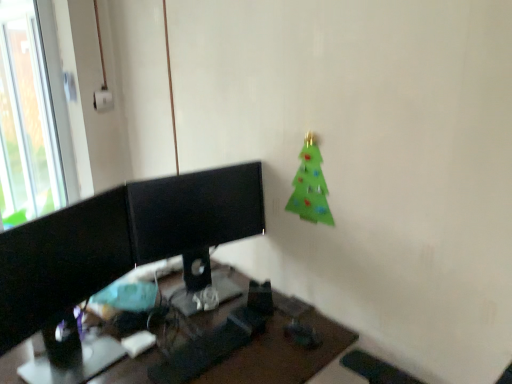
I want to click on free region under black glossy monitor at center (from a real-world perspective), so click(x=208, y=288).